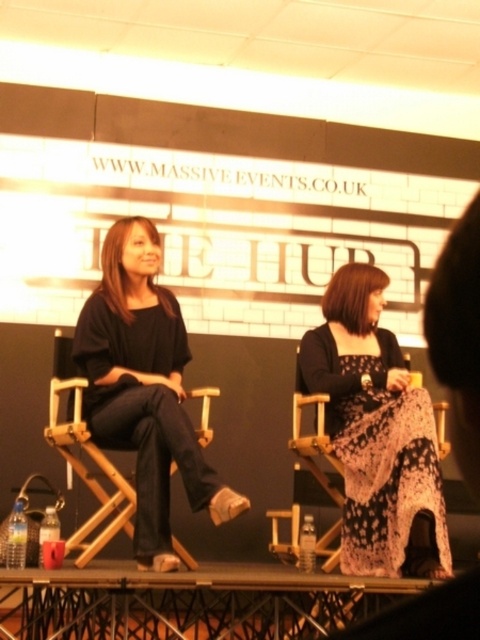
Looking at this image, between black lace dress at center and matte black top at center, which one is positioned lower?

black lace dress at center is lower down.

Is black lace dress at center bigger than matte black top at center?

No, black lace dress at center is not bigger than matte black top at center.

You are a GUI agent. You are given a task and a screenshot of the screen. Output one action in this format:
    pyautogui.click(x=<x>, y=<y>)
    Task: Click on the black lace dress at center
    This screenshot has height=640, width=480.
    Given the screenshot: What is the action you would take?
    pyautogui.click(x=376, y=433)

You are a GUI agent. You are given a task and a screenshot of the screen. Output one action in this format:
    pyautogui.click(x=<x>, y=<y>)
    Task: Click on the black lace dress at center
    
    Given the screenshot: What is the action you would take?
    pyautogui.click(x=376, y=433)